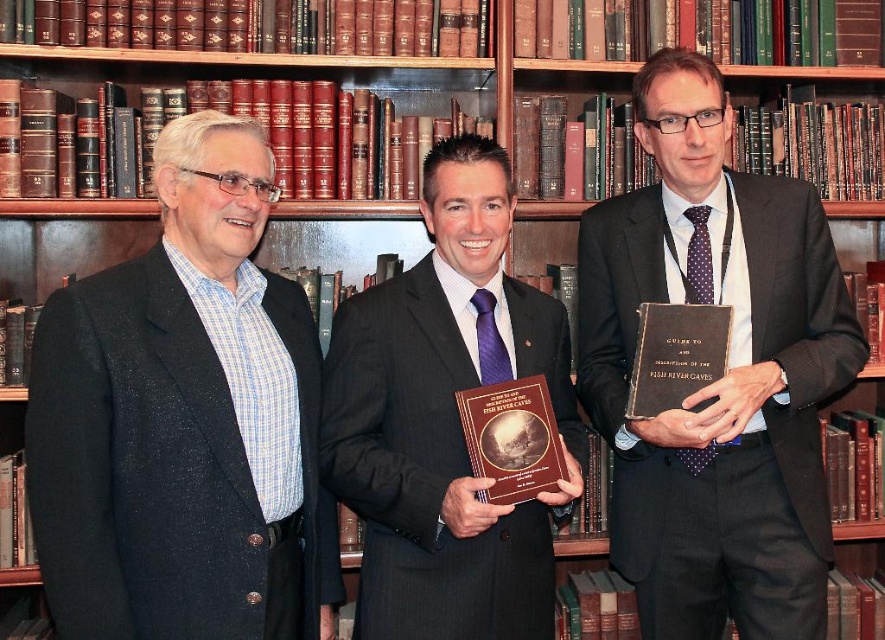
You are a photographer planning to take a group photo of the matte black suit at left and the matte black suit at center. Since you want to ensure both are visible in the frame, which one should you position closer to the camera to avoid cropping?

The matte black suit at center should be positioned closer to the camera because it is shorter than the matte black suit at left, ensuring both are fully visible in the frame.

You are a photographer standing at the entrance of the library. You want to take a photo of the matte black suit at left and the matte black book at center. The camera you are using has a minimum focus distance of 28 inches. Will both subjects be in focus?

The matte black suit at left is 29.23 inches away from the matte black book at center. Since the minimum focus distance of the camera is 28 inches, both subjects will be within the focus range and should be in focus.

You are a visitor in a library and see the matte black book at center and the matte black suit at center. Which object is positioned to the right of the other?

The matte black book at center is to the right of the matte black suit at center.